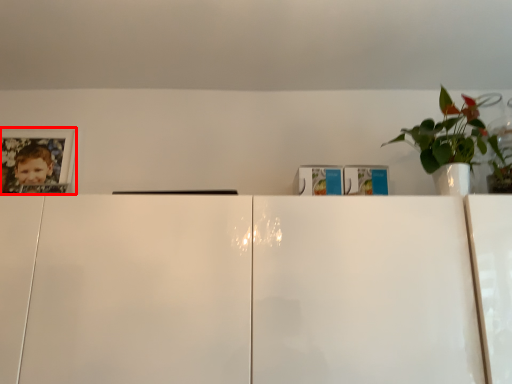
Question: From the image's perspective, considering the relative positions of picture frame (annotated by the red box) and houseplant in the image provided, where is picture frame (annotated by the red box) located with respect to the staircase?

Choices:
 (A) below
 (B) above

Answer: (A)